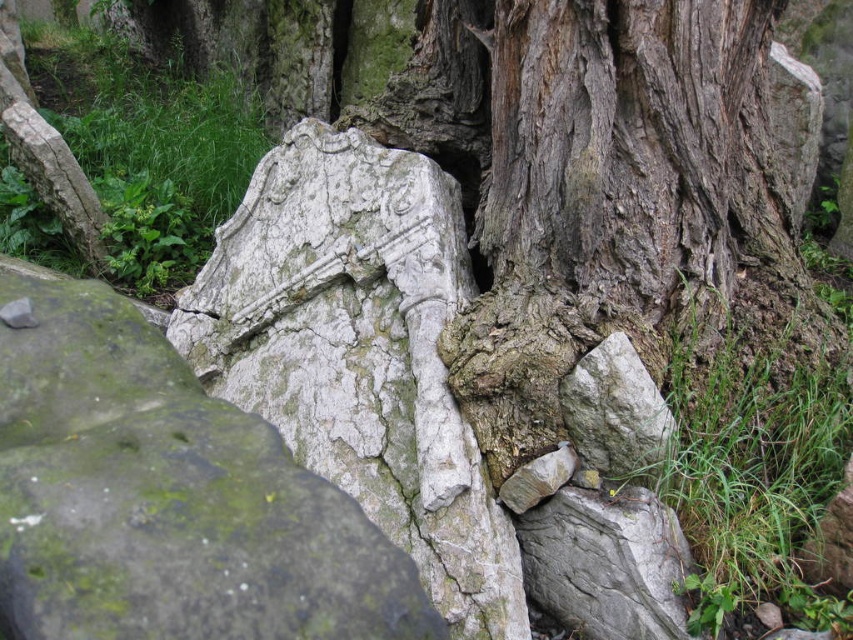
You are an archaeologist examining the outdoor scene. You notice the weathered stone at center and the gray rough rock at center. Which object is located to the left of the other?

The weathered stone at center is positioned on the left side of gray rough rock at center, so the weathered stone at center is to the left of the gray rough rock at center.

You are a botanist examining the gray rough bark tree trunk at center and the white cracked stone at center. Which object is located to the right of the other?

The gray rough bark tree trunk at center is positioned on the right side of white cracked stone at center, so the tree trunk is to the right of the stone.